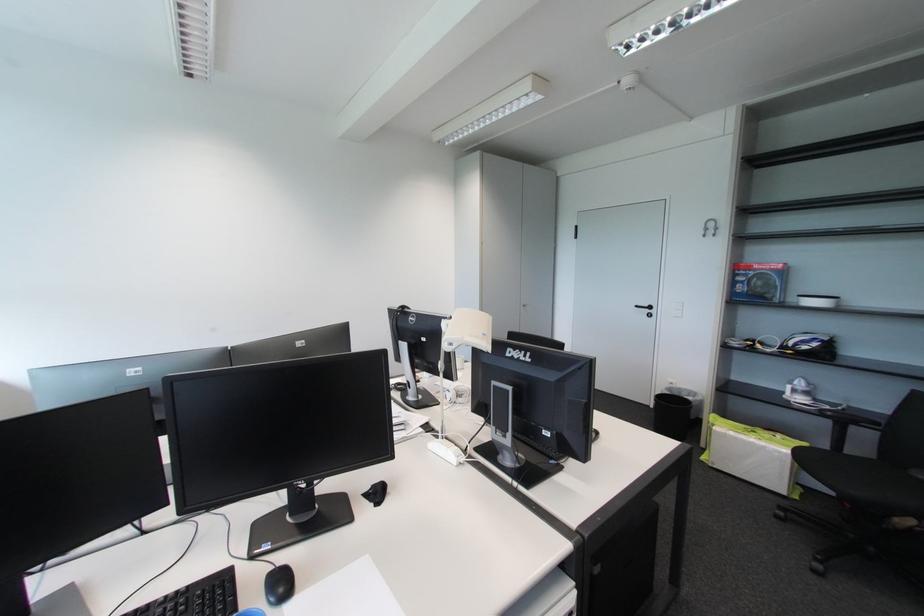
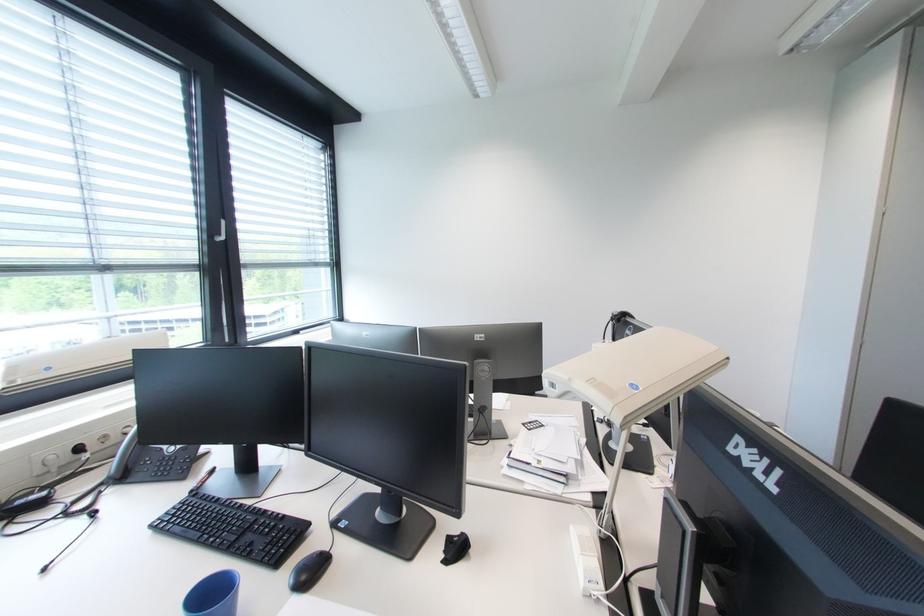
The point at (468, 339) is marked in the first image. Where is the corresponding point in the second image?

(577, 381)